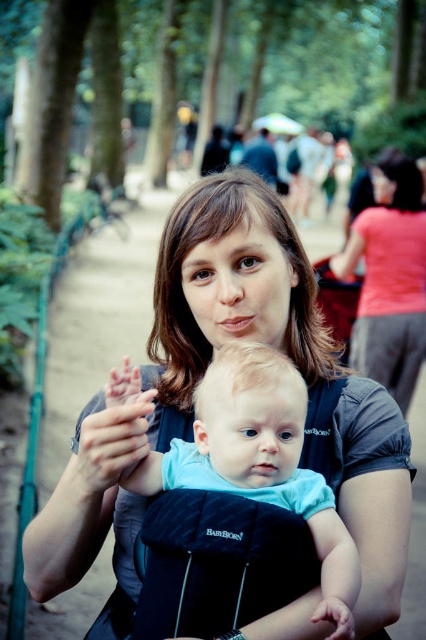
Question: In this image, where is matte skin hand at center located relative to smooth skin hand at center?

Choices:
 (A) above
 (B) below

Answer: (A)

Question: Which of the following is the farthest from the observer?

Choices:
 (A) (351, 630)
 (B) (360, 502)
 (C) (134, 481)

Answer: (B)

Question: Based on their relative distances, which object is nearer to the matte skin hand at center?

Choices:
 (A) matte gray shirt at upper right
 (B) smooth skin hand at center

Answer: (B)

Question: Is matte gray shirt at center below matte gray shirt at upper right?

Choices:
 (A) no
 (B) yes

Answer: (B)

Question: Is matte gray shirt at center thinner than matte gray shirt at upper right?

Choices:
 (A) yes
 (B) no

Answer: (A)

Question: Among these points, which one is farthest from the camera?

Choices:
 (A) (322, 602)
 (B) (365, 506)
 (C) (388, 288)

Answer: (C)